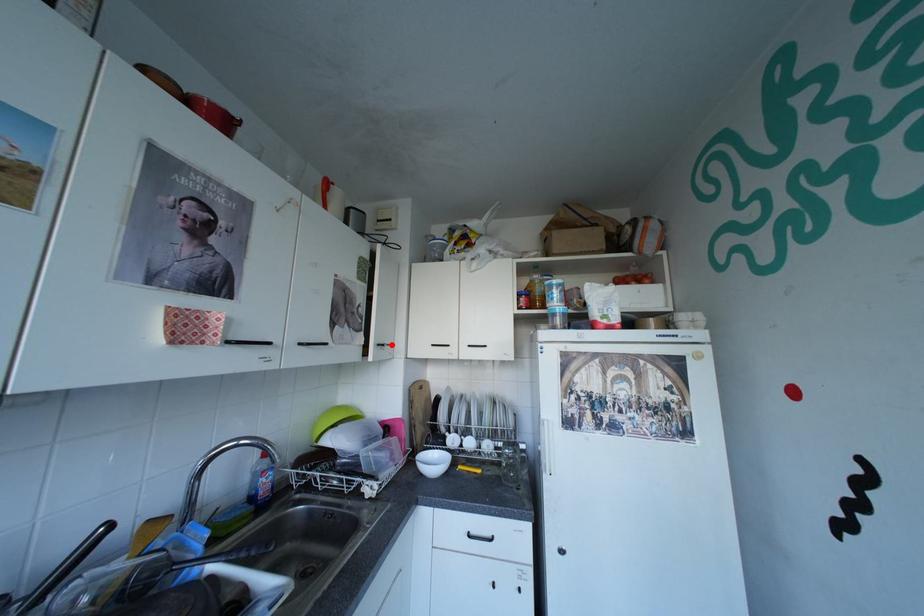
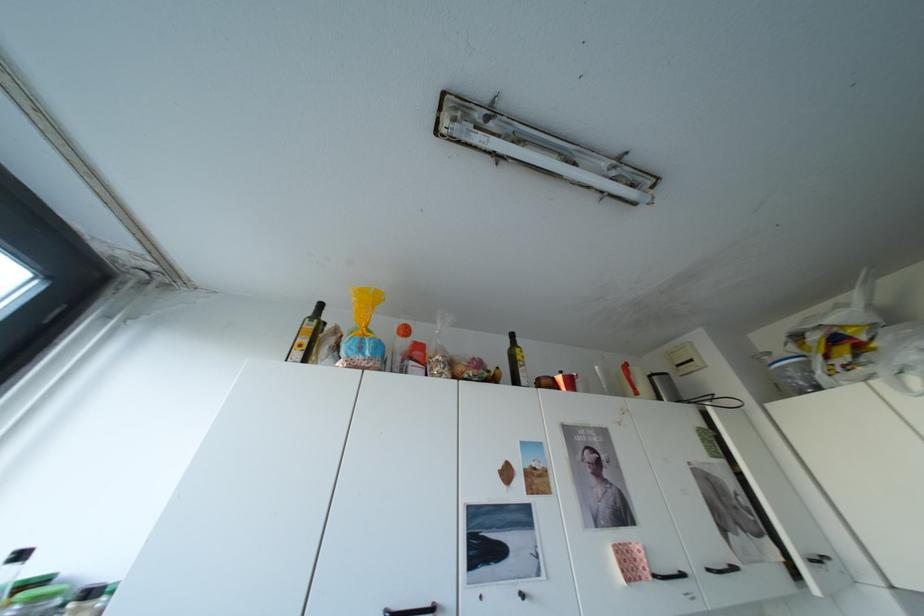
Question: I am providing you with two images of the same scene from different viewpoints. In image1, a red point is highlighted. Considering the same 3D point in image2, which of the following is correct?

Choices:
 (A) It is closer
 (B) It is farther

Answer: (A)